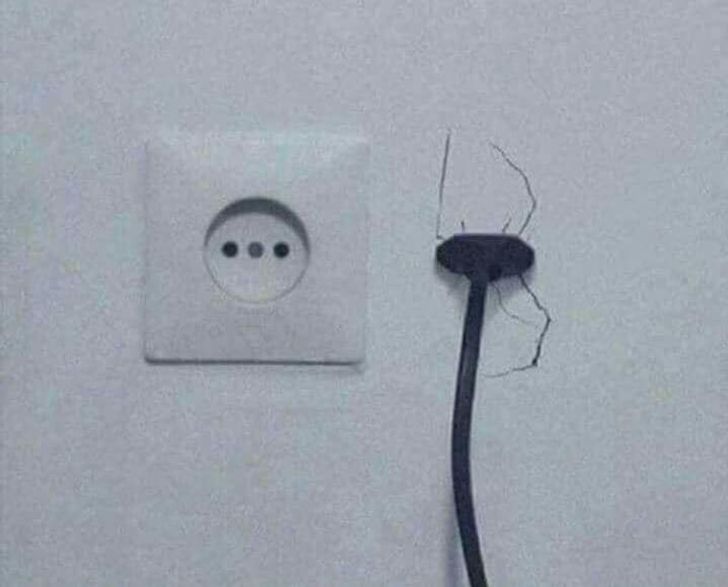
This screenshot has width=728, height=587. Identify the location of black cord. (464, 414).